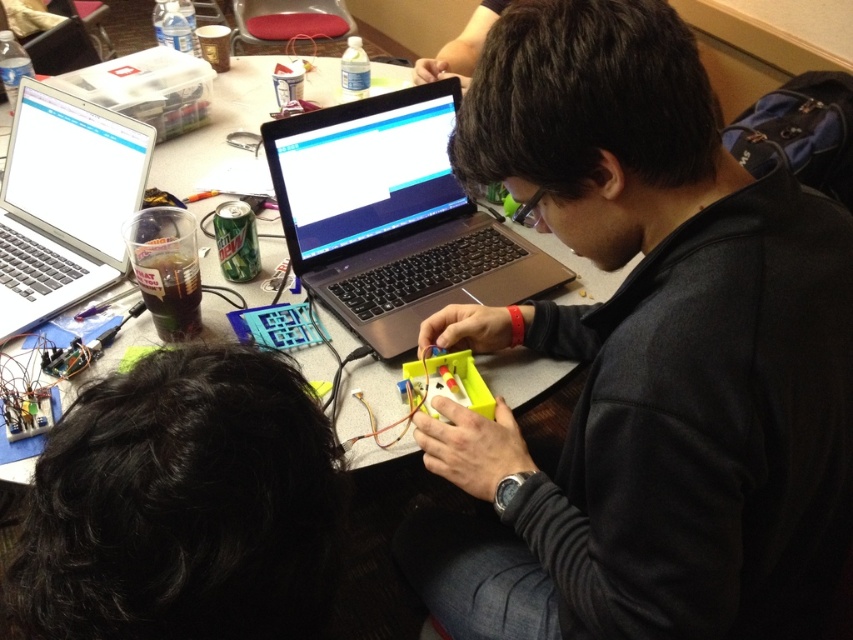
You are standing in the workspace and need to reach the silver metallic laptop at center to retrieve a USB drive. Considering your arm span is 1.5 meters, can you comfortably reach it without moving closer?

The silver metallic laptop at center is 1.07 meters away from you. Since your arm span is 1.5 meters, you can comfortably reach it without moving closer.

You are a technician trying to access the keyboard of the silver metallic laptop at center. Is the black matte laptop at center blocking your access to it?

The black matte laptop at center is in front of the silver metallic laptop at center, so it is blocking access to the silver metallic laptop at center.

You are a visitor observing the workspace. You notice the silver metallic laptop at center and the matte plastic table at center. Which object is positioned lower from the ground?

The silver metallic laptop at center is positioned lower from the ground than the matte plastic table at center because it is placed below it.